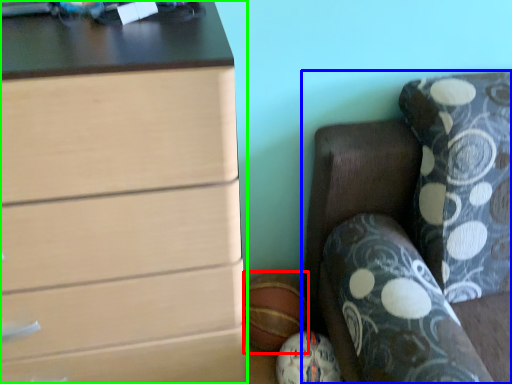
Question: Which object is the closest to the sports equipment (highlighted by a red box)? Choose among these: furniture (highlighted by a blue box) or chest of drawers (highlighted by a green box).

Choices:
 (A) furniture
 (B) chest of drawers

Answer: (A)